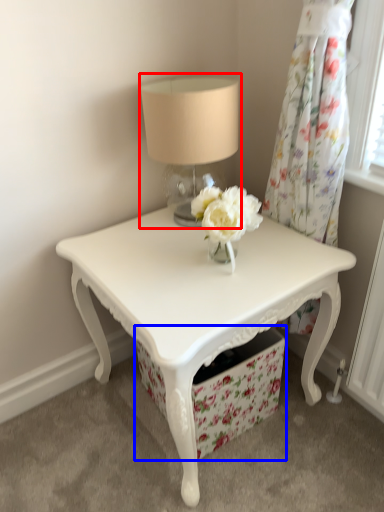
Question: Which point is closer to the camera, table lamp (highlighted by a red box) or drawer (highlighted by a blue box)?

Choices:
 (A) table lamp
 (B) drawer

Answer: (A)